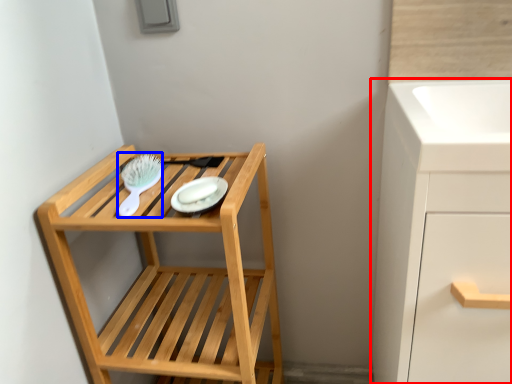
Question: Which of the following is the farthest to the observer, bathroom cabinet (highlighted by a red box) or brush (highlighted by a blue box)?

Choices:
 (A) bathroom cabinet
 (B) brush

Answer: (B)